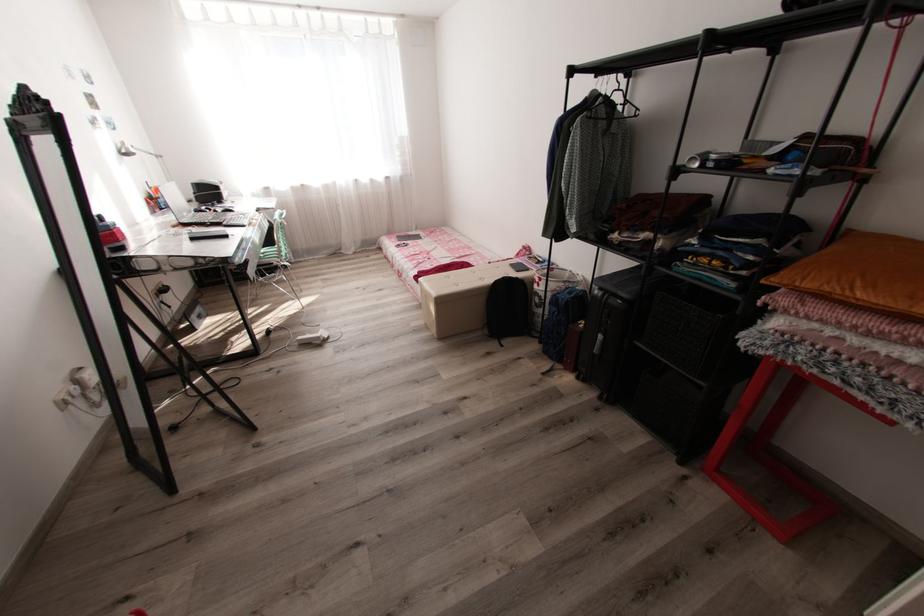
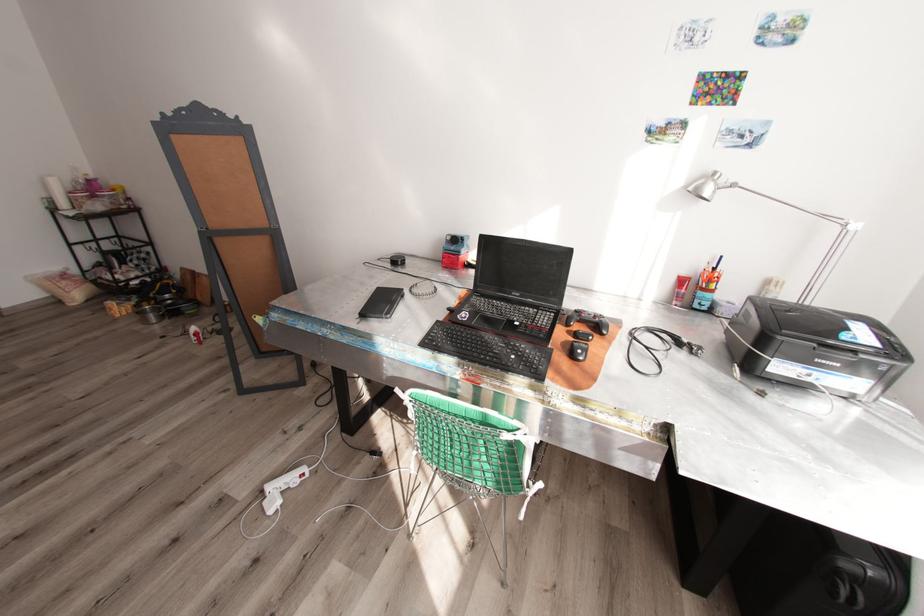
In the second image, find the point that corresponds to (167,207) in the first image.

(699, 305)